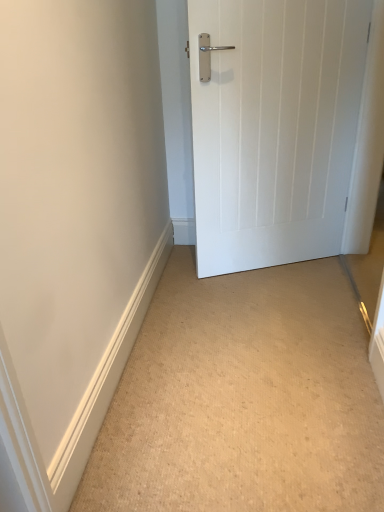
Question: Can you confirm if beige carpet at lower center is smaller than white wooden door at right?

Choices:
 (A) yes
 (B) no

Answer: (A)

Question: Would you say beige carpet at lower center is outside white wooden door at right?

Choices:
 (A) no
 (B) yes

Answer: (B)

Question: Is beige carpet at lower center to the right of white wooden door at right from the viewer's perspective?

Choices:
 (A) no
 (B) yes

Answer: (A)

Question: From a real-world perspective, is beige carpet at lower center positioned over white wooden door at right based on gravity?

Choices:
 (A) no
 (B) yes

Answer: (A)

Question: Could white wooden door at right be considered to be inside beige carpet at lower center?

Choices:
 (A) yes
 (B) no

Answer: (B)

Question: Considering the relative sizes of beige carpet at lower center and white wooden door at right in the image provided, is beige carpet at lower center taller than white wooden door at right?

Choices:
 (A) no
 (B) yes

Answer: (A)

Question: Is white wooden door at right bigger than beige carpet at lower center?

Choices:
 (A) yes
 (B) no

Answer: (A)

Question: Does white wooden door at right turn towards beige carpet at lower center?

Choices:
 (A) no
 (B) yes

Answer: (B)

Question: Are white wooden door at right and beige carpet at lower center far apart?

Choices:
 (A) yes
 (B) no

Answer: (B)

Question: From the image's perspective, is white wooden door at right on beige carpet at lower center?

Choices:
 (A) yes
 (B) no

Answer: (A)

Question: From a real-world perspective, is white wooden door at right on beige carpet at lower center?

Choices:
 (A) no
 (B) yes

Answer: (B)

Question: Is white wooden door at right in contact with beige carpet at lower center?

Choices:
 (A) no
 (B) yes

Answer: (A)

Question: From a real-world perspective, relative to white wooden door at right, is beige carpet at lower center vertically above or below?

Choices:
 (A) above
 (B) below

Answer: (B)